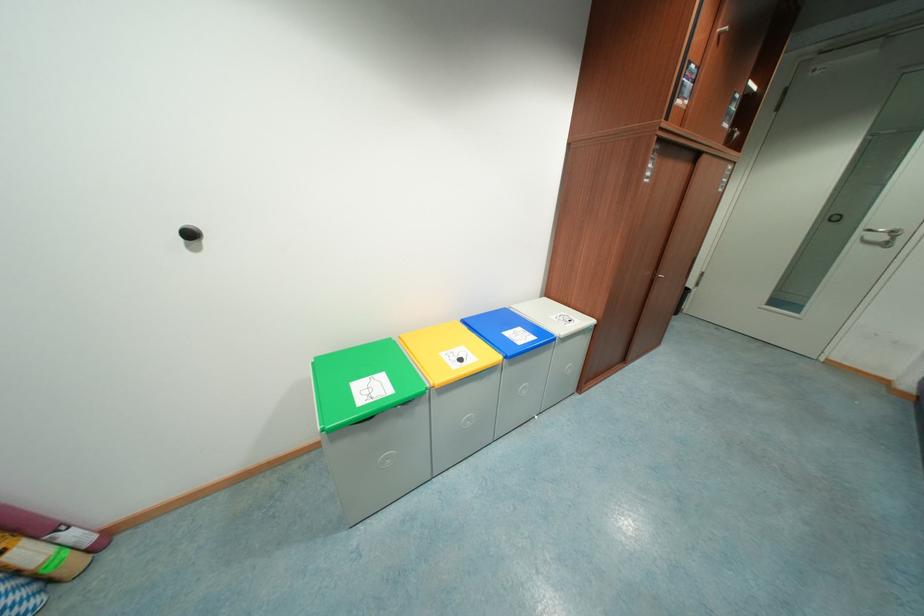
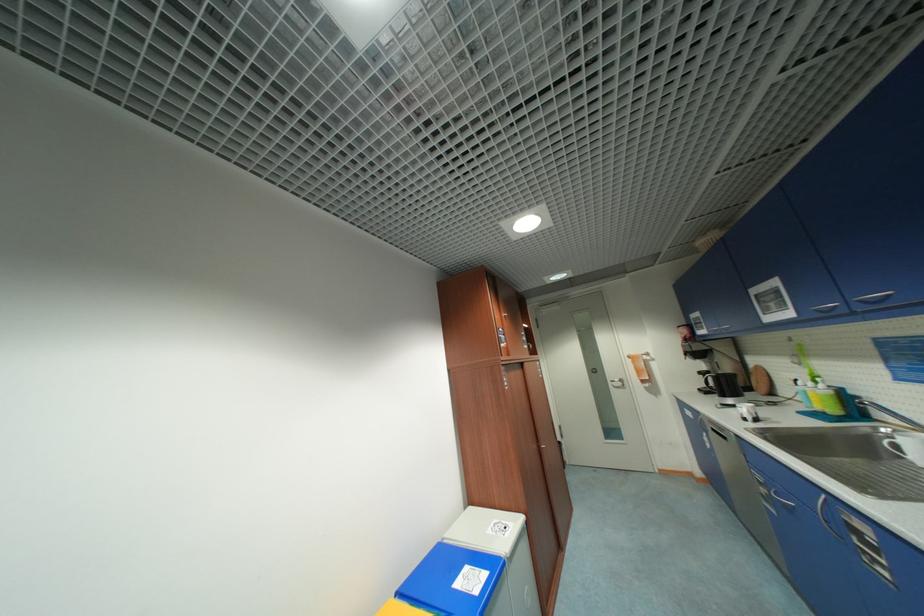
In the second image, find the point that corresponds to the point at 864,235 in the first image.

(615, 384)